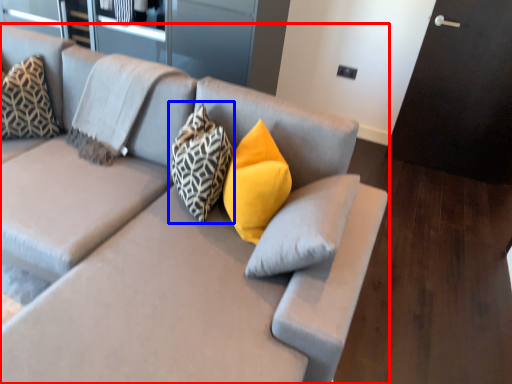
Question: Which object appears farthest to the camera in this image, studio couch (highlighted by a red box) or pillow (highlighted by a blue box)?

Choices:
 (A) studio couch
 (B) pillow

Answer: (B)